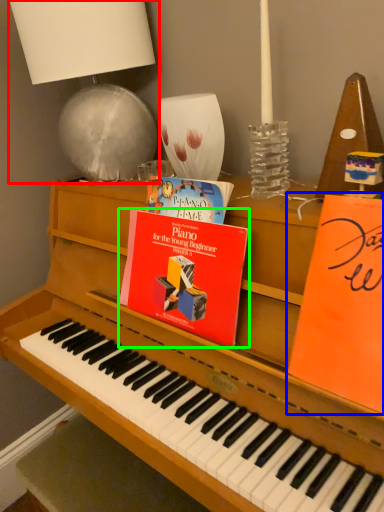
Question: Based on their relative distances, which object is farther from table lamp (highlighted by a red box)? Choose from paperback book (highlighted by a blue box) and paperback book (highlighted by a green box).

Choices:
 (A) paperback book
 (B) paperback book

Answer: (A)